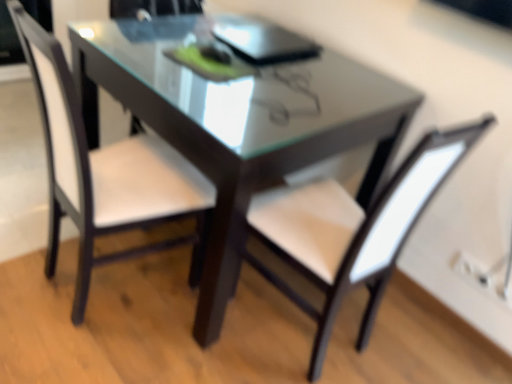
You are a GUI agent. You are given a task and a screenshot of the screen. Output one action in this format:
    pyautogui.click(x=<x>, y=<y>)
    Task: Click on the free point below white leather chair at center, marked as the 2th chair in a left-to-right arrangement (from a real-world perspective)
    This screenshot has height=384, width=512.
    Given the screenshot: What is the action you would take?
    pyautogui.click(x=298, y=322)